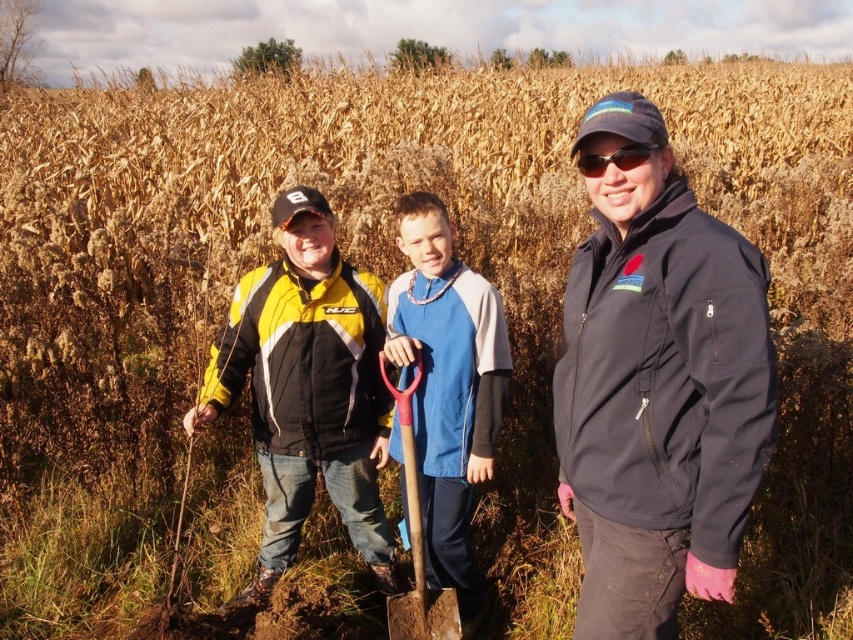
You are a photographer trying to capture a closeup of the black plastic sunglasses at center without the blue fleece jacket at center blocking the view. Can you adjust your camera angle to focus on the sunglasses while avoiding the jacket?

The blue fleece jacket at center is larger than the black plastic sunglasses at center, so adjusting the camera angle might be possible to focus on the sunglasses while avoiding the jacket by moving the camera position slightly to the side or lowering the angle to frame around the jacket.